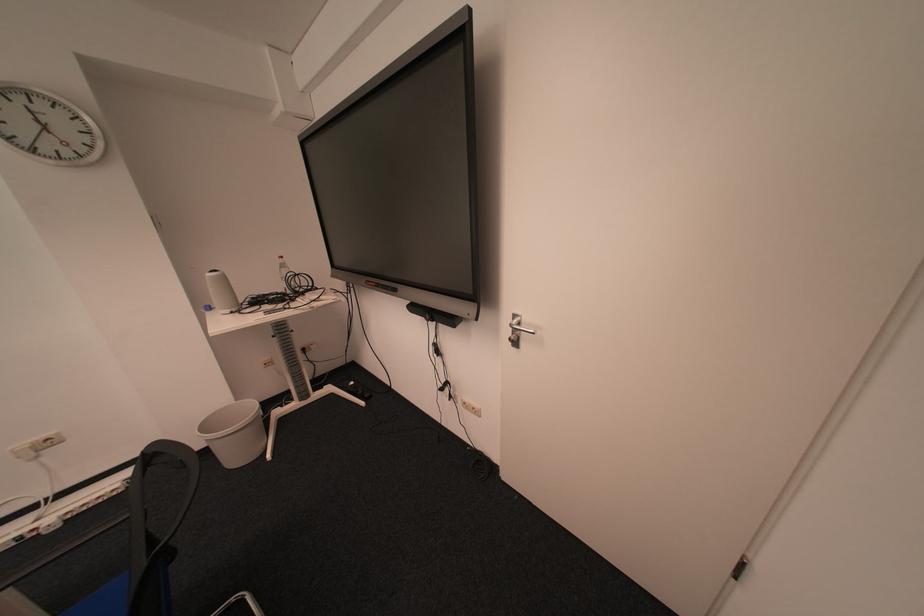
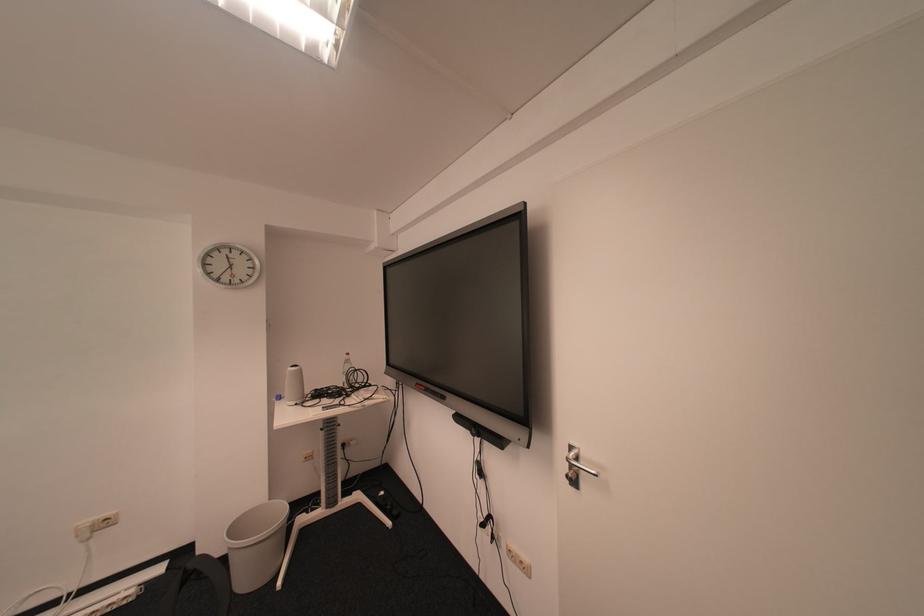
The images are taken continuously from a first-person perspective. In which direction are you moving?

The movement direction of the cameraman is left, backward.